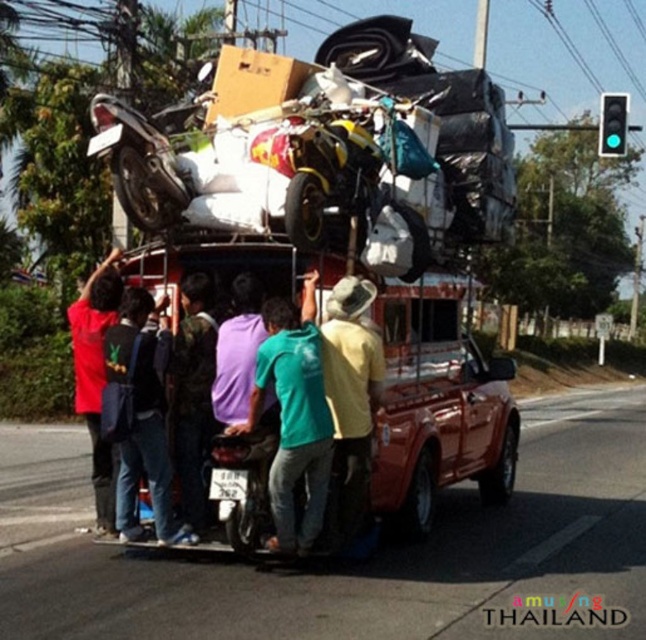
Does yellow matte motorcycle at center have a greater width compared to green matte shirt at center?

No, yellow matte motorcycle at center is not wider than green matte shirt at center.

Which is behind, point (256, 173) or point (379, 346)?

The point (256, 173) is behind.

What are the coordinates of `yellow matte motorcycle at center` in the screenshot? It's located at (326, 154).

Can you confirm if green cotton shirt at center is thinner than green matte shirt at center?

Incorrect, green cotton shirt at center's width is not less than green matte shirt at center's.

Is green cotton shirt at center shorter than green matte shirt at center?

Correct, green cotton shirt at center is not as tall as green matte shirt at center.

Identify the location of green cotton shirt at center. The height and width of the screenshot is (640, 646). (293, 422).

Where is `green cotton shirt at center`? The height and width of the screenshot is (640, 646). green cotton shirt at center is located at coordinates (293, 422).

Is yellow matte motorcycle at center smaller than camouflage fabric shirt at center?

Yes, yellow matte motorcycle at center is smaller than camouflage fabric shirt at center.

Is point (293, 145) positioned after point (185, 385)?

That is False.

You are a GUI agent. You are given a task and a screenshot of the screen. Output one action in this format:
    pyautogui.click(x=<x>, y=<y>)
    Task: Click on the yellow matte motorcycle at center
    
    Given the screenshot: What is the action you would take?
    pyautogui.click(x=326, y=154)